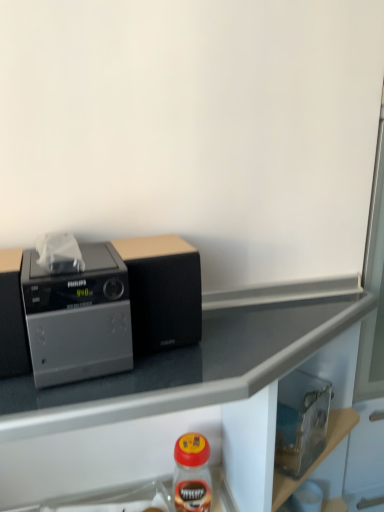
Question: Does point (49, 312) appear closer or farther from the camera than point (66, 392)?

Choices:
 (A) closer
 (B) farther

Answer: (A)

Question: Looking at their shapes, would you say satin silver radio at left is wider or thinner than metallic gray countertop at upper left?

Choices:
 (A) wide
 (B) thin

Answer: (B)

Question: Which object is positioned farthest from the black matte speaker at center?

Choices:
 (A) matte plastic bottle at lower center
 (B) satin silver radio at left
 (C) metallic gray countertop at upper left

Answer: (A)

Question: Which of these objects is positioned farthest from the matte plastic bottle at lower center?

Choices:
 (A) black matte speaker at center
 (B) satin silver radio at left
 (C) metallic gray countertop at upper left

Answer: (B)